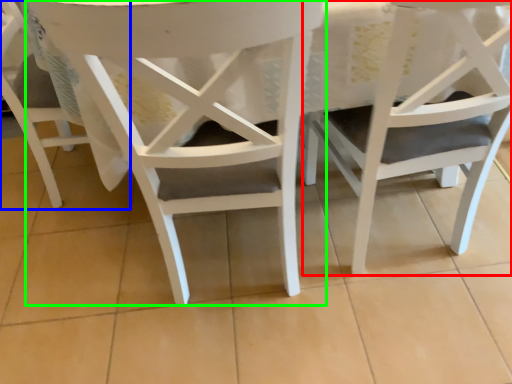
Question: Which object is the closest to the chair (highlighted by a red box)? Choose among these: chair (highlighted by a blue box) or chair (highlighted by a green box).

Choices:
 (A) chair
 (B) chair

Answer: (B)